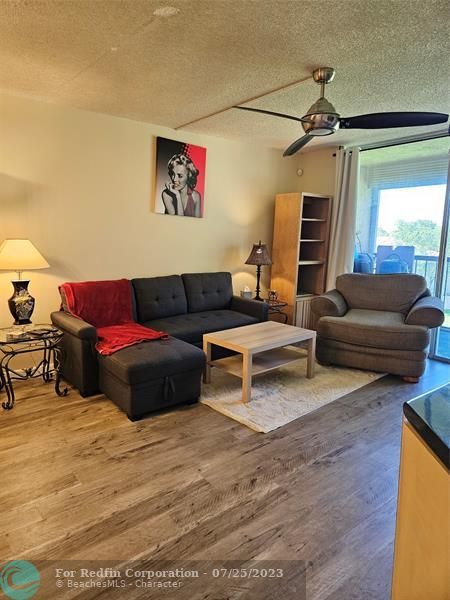
You are a GUI agent. You are given a task and a screenshot of the screen. Output one action in this format:
    pyautogui.click(x=<x>, y=<y>)
    Task: Click on the throw rug
    
    Given the screenshot: What is the action you would take?
    pyautogui.click(x=276, y=418)